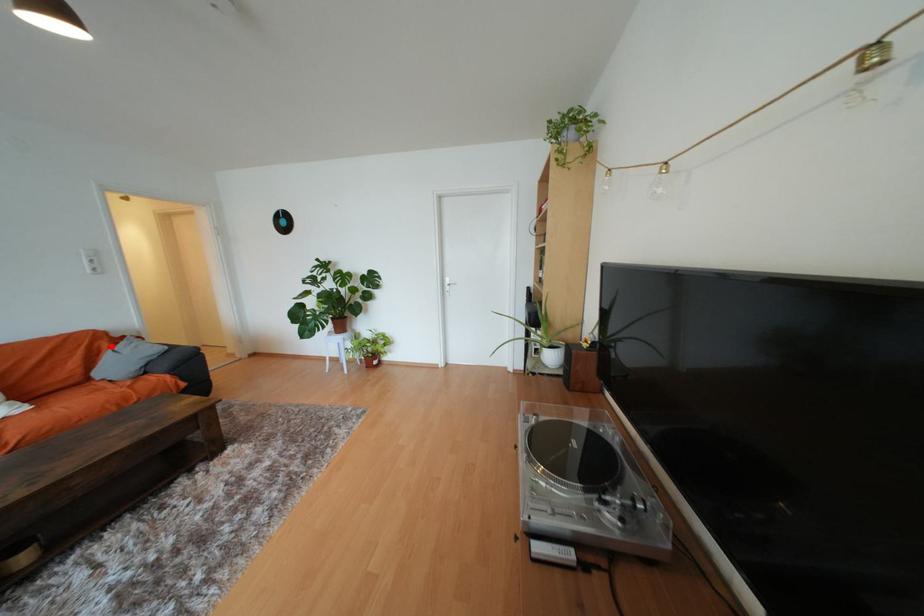
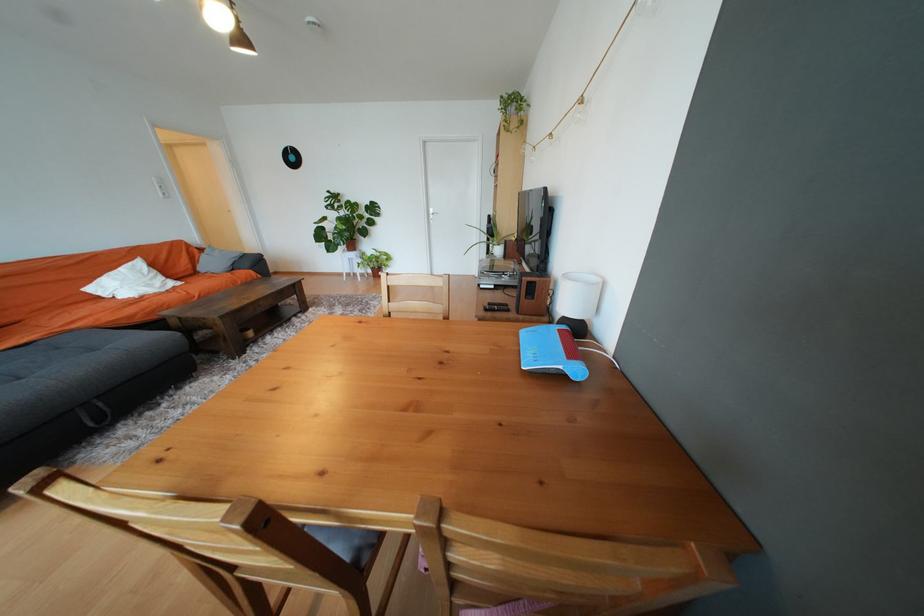
Where in the second image is the point corresponding to the highlighted location from the first image?

(202, 252)